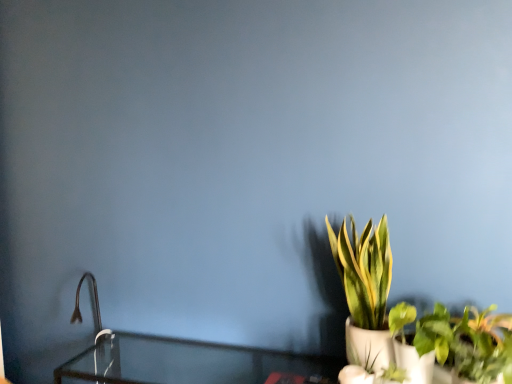
Question: From a real-world perspective, is green leafy plant in white pot at right beneath green leafy plant at lower right?

Choices:
 (A) yes
 (B) no

Answer: (B)

Question: Can you confirm if green leafy plant in white pot at right is taller than green leafy plant at lower right?

Choices:
 (A) no
 (B) yes

Answer: (B)

Question: Is green leafy plant in white pot at right not inside green leafy plant at lower right?

Choices:
 (A) no
 (B) yes

Answer: (B)

Question: Are green leafy plant in white pot at right and green leafy plant at lower right beside each other?

Choices:
 (A) no
 (B) yes

Answer: (A)

Question: Would you say green leafy plant in white pot at right contains green leafy plant at lower right?

Choices:
 (A) yes
 (B) no

Answer: (B)

Question: Is green leafy plant in white pot at right facing away from green leafy plant at lower right?

Choices:
 (A) yes
 (B) no

Answer: (B)

Question: Does green leafy plant at lower right lie behind green leafy plant in white pot at right?

Choices:
 (A) no
 (B) yes

Answer: (A)

Question: From the image's perspective, is green leafy plant at lower right over green leafy plant in white pot at right?

Choices:
 (A) yes
 (B) no

Answer: (B)

Question: Is green leafy plant at lower right aimed at green leafy plant in white pot at right?

Choices:
 (A) yes
 (B) no

Answer: (B)

Question: Does green leafy plant at lower right have a larger size compared to green leafy plant in white pot at right?

Choices:
 (A) no
 (B) yes

Answer: (A)

Question: Considering the relative positions of green leafy plant at lower right and green leafy plant in white pot at right in the image provided, is green leafy plant at lower right in front of green leafy plant in white pot at right?

Choices:
 (A) yes
 (B) no

Answer: (A)

Question: Is green leafy plant at lower right positioned with its back to green leafy plant in white pot at right?

Choices:
 (A) yes
 (B) no

Answer: (A)

Question: Could you tell me if matte black faucet at left is facing green leafy plant in white pot at right?

Choices:
 (A) no
 (B) yes

Answer: (A)